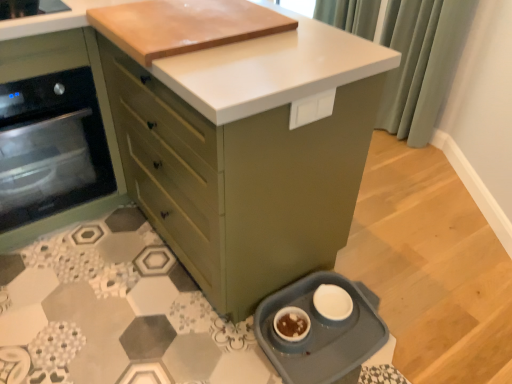
The height and width of the screenshot is (384, 512). Identify the location of vacant area that lies to the right of blue plastic pet dish at lower right. (430, 321).